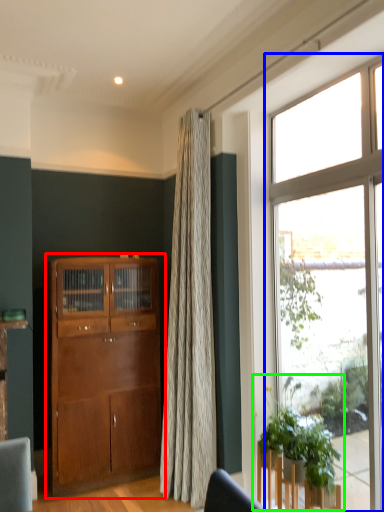
Question: Based on their relative distances, which object is nearer to cabinetry (highlighted by a red box)? Choose from window (highlighted by a blue box) and houseplant (highlighted by a green box).

Choices:
 (A) window
 (B) houseplant

Answer: (B)